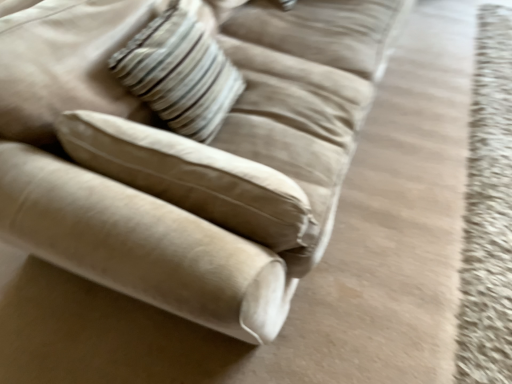
Question: From the image's perspective, does suede beige couch at upper left appear lower than striped fabric pillow at upper center?

Choices:
 (A) yes
 (B) no

Answer: (B)

Question: Considering the relative sizes of suede beige couch at upper left and striped fabric pillow at upper center in the image provided, is suede beige couch at upper left smaller than striped fabric pillow at upper center?

Choices:
 (A) yes
 (B) no

Answer: (B)

Question: Does suede beige couch at upper left appear on the right side of striped fabric pillow at upper center?

Choices:
 (A) no
 (B) yes

Answer: (B)

Question: Is striped fabric pillow at upper center surrounded by suede beige couch at upper left?

Choices:
 (A) no
 (B) yes

Answer: (B)

Question: Does suede beige couch at upper left have a lesser width compared to striped fabric pillow at upper center?

Choices:
 (A) yes
 (B) no

Answer: (B)

Question: Is suede beige couch at upper left aimed at striped fabric pillow at upper center?

Choices:
 (A) no
 (B) yes

Answer: (B)

Question: Is striped fabric pillow at upper center completely or partially outside of suede beige couch at upper left?

Choices:
 (A) yes
 (B) no

Answer: (B)

Question: Is striped fabric pillow at upper center shorter than suede beige couch at upper left?

Choices:
 (A) no
 (B) yes

Answer: (B)

Question: From the image's perspective, does striped fabric pillow at upper center appear higher than suede beige couch at upper left?

Choices:
 (A) no
 (B) yes

Answer: (A)

Question: Does striped fabric pillow at upper center have a greater height compared to suede beige couch at upper left?

Choices:
 (A) no
 (B) yes

Answer: (A)

Question: Does striped fabric pillow at upper center appear on the right side of suede beige couch at upper left?

Choices:
 (A) yes
 (B) no

Answer: (B)

Question: Can you confirm if striped fabric pillow at upper center is thinner than suede beige couch at upper left?

Choices:
 (A) yes
 (B) no

Answer: (A)

Question: From a real-world perspective, is suede beige couch at upper left above or below striped fabric pillow at upper center?

Choices:
 (A) below
 (B) above

Answer: (A)